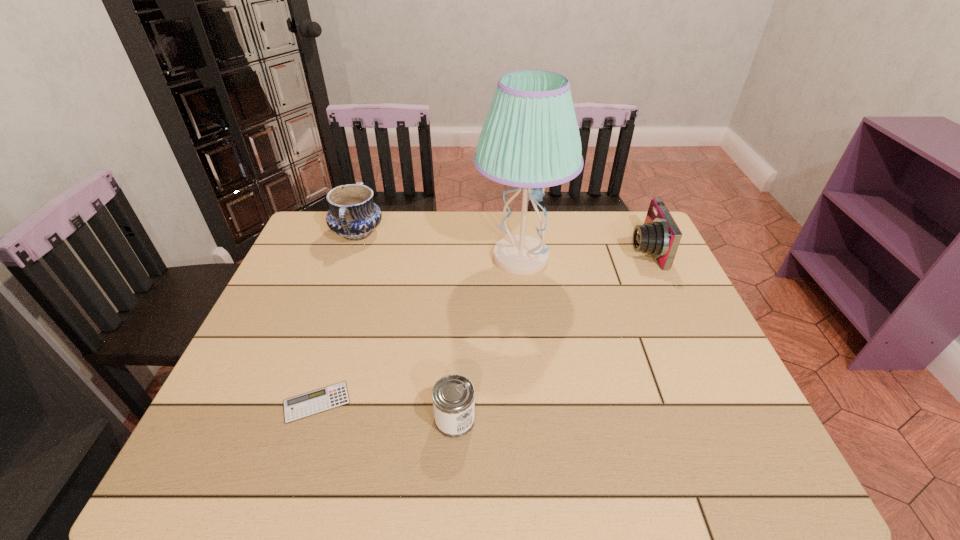
This screenshot has height=540, width=960. I want to click on object at the far right corner, so click(x=659, y=236).

This screenshot has width=960, height=540. What are the coordinates of `blank space at the far edge of the desktop` in the screenshot? It's located at (402, 228).

In the image, there is a desktop. Where is `free space at the near edge`? free space at the near edge is located at coordinates pyautogui.click(x=427, y=459).

The height and width of the screenshot is (540, 960). In the image, there is a desktop. In order to click on vacant space at the left edge in this screenshot , I will do `click(235, 378)`.

At what (x,y) coordinates should I click in order to perform the action: click on vacant space at the right edge of the desktop. Please return your answer as a coordinate pair (x, y). The image size is (960, 540). Looking at the image, I should click on (707, 436).

The height and width of the screenshot is (540, 960). In order to click on free spot between the rightmost object and the shortest object in this screenshot , I will do `click(481, 326)`.

The height and width of the screenshot is (540, 960). Find the location of `unoccupied position between the can and the rightmost object`. unoccupied position between the can and the rightmost object is located at coordinates (550, 335).

Image resolution: width=960 pixels, height=540 pixels. I want to click on unoccupied position between the calculator and the pottery, so click(337, 318).

Image resolution: width=960 pixels, height=540 pixels. Identify the location of free point between the rightmost object and the can. (550, 335).

Find the location of a particular element. The image size is (960, 540). free space that is in between the lamp and the pottery is located at coordinates (439, 246).